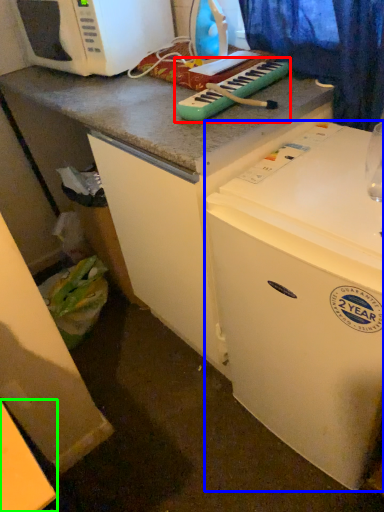
Question: Which object is positioned closest to musical keyboard (highlighted by a red box)? Select from refrigerator (highlighted by a blue box) and counter top (highlighted by a green box).

Choices:
 (A) refrigerator
 (B) counter top

Answer: (A)